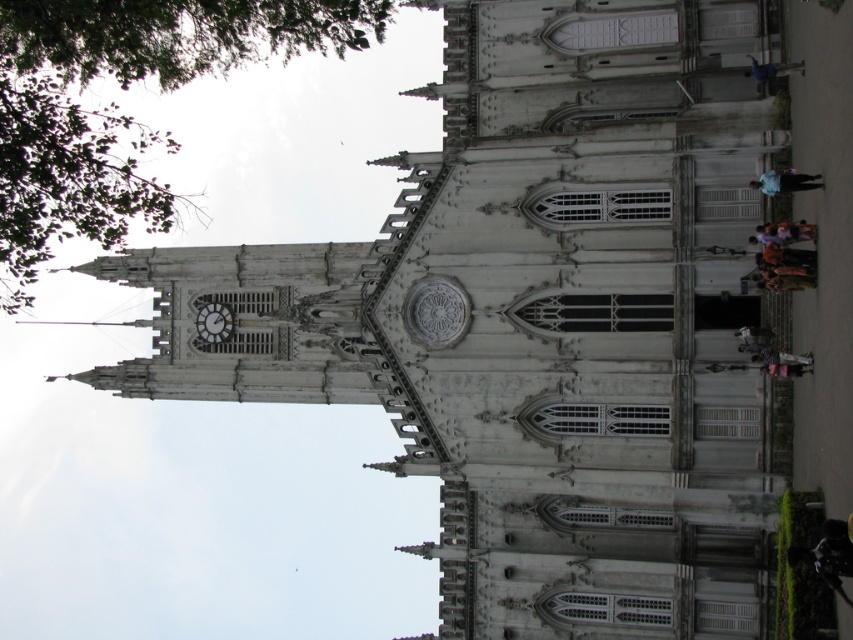
Question: Among these points, which one is nearest to the camera?

Choices:
 (A) (805, 365)
 (B) (200, 324)

Answer: (A)

Question: Estimate the real-world distances between objects in this image. Which object is closer to the green leafy tree at upper left?

Choices:
 (A) dark brown leather jacket at lower right
 (B) striped fabric at lower right
 (C) dark gray stone clock at upper left
 (D) light purple shirt at lower right

Answer: (C)

Question: Does orange fabric at right appear on the right side of brown leather bag at lower right?

Choices:
 (A) no
 (B) yes

Answer: (A)

Question: Does blue fabric at upper right have a larger size compared to orange fabric at right?

Choices:
 (A) no
 (B) yes

Answer: (A)

Question: Does dark gray stone clock at upper left come in front of striped fabric at lower right?

Choices:
 (A) yes
 (B) no

Answer: (B)

Question: Among these objects, which one is farthest from the camera?

Choices:
 (A) light purple shirt at lower right
 (B) brown leather bag at lower right
 (C) striped fabric at lower right

Answer: (C)